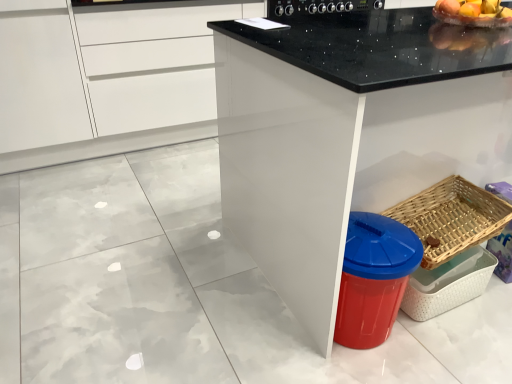
The image size is (512, 384). What do you see at coordinates (112, 82) in the screenshot?
I see `white glossy cabinet at upper left` at bounding box center [112, 82].

What do you see at coordinates (451, 218) in the screenshot? The image size is (512, 384). I see `woven wood basket at lower right` at bounding box center [451, 218].

Describe the element at coordinates (323, 11) in the screenshot. I see `black glossy stove at upper center` at that location.

This screenshot has width=512, height=384. Describe the element at coordinates (473, 8) in the screenshot. I see `shiny plastic bowl at upper right` at that location.

Locate an element on the screen. This screenshot has width=512, height=384. white glossy cabinet at upper left is located at coordinates (112, 82).

Consider the image. Considering the sizes of black glossy stove at upper center and woven wood basket at lower right in the image, is black glossy stove at upper center bigger or smaller than woven wood basket at lower right?

Clearly, black glossy stove at upper center is larger in size than woven wood basket at lower right.

From a real-world perspective, is black glossy stove at upper center physically below woven wood basket at lower right?

No, from a real-world perspective, black glossy stove at upper center is not beneath woven wood basket at lower right.

Based on their positions, is black glossy stove at upper center located to the left or right of woven wood basket at lower right?

Clearly, black glossy stove at upper center is on the left of woven wood basket at lower right in the image.

Is the surface of black glossy stove at upper center in direct contact with woven wood basket at lower right?

No, black glossy stove at upper center is not making contact with woven wood basket at lower right.

Can you tell me how much shiny plastic bowl at upper right and black granite countertop at center differ in facing direction?

They differ by 3.02 degrees in their facing directions.

Is black granite countertop at center inside shiny plastic bowl at upper right?

Actually, black granite countertop at center is outside shiny plastic bowl at upper right.

How far apart are shiny plastic bowl at upper right and black granite countertop at center?

shiny plastic bowl at upper right and black granite countertop at center are 25.53 inches apart from each other.

Can you confirm if shiny plastic bowl at upper right is positioned to the right of black granite countertop at center?

No.

Is black glossy stove at upper center completely or partially inside shiny plastic bowl at upper right?

Actually, black glossy stove at upper center is outside shiny plastic bowl at upper right.

Considering the relative positions of shiny plastic bowl at upper right and black glossy stove at upper center in the image provided, is shiny plastic bowl at upper right in front of black glossy stove at upper center?

Yes, it is.

Which is closer to the camera, (509, 17) or (334, 12)?

Point (509, 17).

How different are the orientations of black glossy stove at upper center and shiny plastic bowl at upper right in degrees?

There is a 1.65-degree angle between the facing directions of black glossy stove at upper center and shiny plastic bowl at upper right.

Where is `fruit that appears on the right of black glossy stove at upper center`? Image resolution: width=512 pixels, height=384 pixels. fruit that appears on the right of black glossy stove at upper center is located at coordinates (473, 8).

Does point (380, 7) lie in front of point (437, 3)?

That is True.

Is black glossy stove at upper center smaller than shiny plastic bowl at upper right?

No, black glossy stove at upper center is not smaller than shiny plastic bowl at upper right.

You are a GUI agent. You are given a task and a screenshot of the screen. Output one action in this format:
    pyautogui.click(x=<x>, y=<y>)
    Task: Click on the basket on the right of white glossy cabinet at upper left
    Image resolution: width=512 pixels, height=384 pixels.
    Given the screenshot: What is the action you would take?
    pyautogui.click(x=451, y=218)

From their relative heights in the image, would you say white glossy cabinet at upper left is taller or shorter than woven wood basket at lower right?

white glossy cabinet at upper left is taller than woven wood basket at lower right.

From the picture: From the image's perspective, does white glossy cabinet at upper left appear higher than woven wood basket at lower right?

Indeed, from the image's perspective, white glossy cabinet at upper left is shown above woven wood basket at lower right.

Is white glossy cabinet at upper left to the left of woven wood basket at lower right from the viewer's perspective?

Yes, white glossy cabinet at upper left is to the left of woven wood basket at lower right.

Is shiny plastic bowl at upper right spatially inside white glossy cabinet at upper left, or outside of it?

shiny plastic bowl at upper right exists outside the volume of white glossy cabinet at upper left.

Is point (510, 15) positioned after point (134, 103)?

No, it is in front of (134, 103).

Are shiny plastic bowl at upper right and white glossy cabinet at upper left far apart?

Yes.

Which is more to the left, shiny plastic bowl at upper right or white glossy cabinet at upper left?

white glossy cabinet at upper left.

From a real-world perspective, who is located higher, woven wood basket at lower right or shiny plastic bowl at upper right?

shiny plastic bowl at upper right.

How distant is woven wood basket at lower right from shiny plastic bowl at upper right?

A distance of 27.93 inches exists between woven wood basket at lower right and shiny plastic bowl at upper right.

Is point (485, 217) more distant than point (445, 3)?

That is False.

How many degrees apart are the facing directions of woven wood basket at lower right and shiny plastic bowl at upper right?

The facing directions of woven wood basket at lower right and shiny plastic bowl at upper right are 1.5 degrees apart.

Locate an element on the screen. This screenshot has height=384, width=512. appliance above the woven wood basket at lower right (from the image's perspective) is located at coordinates (323, 11).

Where is `countertop below the shiny plastic bowl at upper right (from the image's perspective)`? countertop below the shiny plastic bowl at upper right (from the image's perspective) is located at coordinates (349, 134).

Which object lies further to the anchor point black granite countertop at center, white glossy cabinet at upper left or woven wood basket at lower right?

white glossy cabinet at upper left is positioned further to the anchor black granite countertop at center.

Which object lies further to the anchor point shiny plastic bowl at upper right, black glossy stove at upper center or woven wood basket at lower right?

Based on the image, woven wood basket at lower right appears to be further to shiny plastic bowl at upper right.

Looking at the image, which one is located closer to black granite countertop at center, black glossy stove at upper center or shiny plastic bowl at upper right?

The object closer to black granite countertop at center is black glossy stove at upper center.

When comparing their distances from woven wood basket at lower right, does black glossy stove at upper center or white glossy cabinet at upper left seem closer?

The object closer to woven wood basket at lower right is black glossy stove at upper center.

Looking at this image, when comparing their distances from white glossy cabinet at upper left, does black glossy stove at upper center or woven wood basket at lower right seem further?

Among the two, woven wood basket at lower right is located further to white glossy cabinet at upper left.

Estimate the real-world distances between objects in this image. Which object is closer to black glossy stove at upper center, shiny plastic bowl at upper right or black granite countertop at center?

shiny plastic bowl at upper right.

From the image, which object appears to be nearer to black glossy stove at upper center, white glossy cabinet at upper left or shiny plastic bowl at upper right?

shiny plastic bowl at upper right lies closer to black glossy stove at upper center than the other object.

Considering their positions, is woven wood basket at lower right positioned further to white glossy cabinet at upper left than black glossy stove at upper center?

woven wood basket at lower right is further to white glossy cabinet at upper left.

The width and height of the screenshot is (512, 384). I want to click on basket between white glossy cabinet at upper left and shiny plastic bowl at upper right in the horizontal direction, so click(451, 218).

Where is `countertop between shiny plastic bowl at upper right and woven wood basket at lower right vertically`? countertop between shiny plastic bowl at upper right and woven wood basket at lower right vertically is located at coordinates (349, 134).

The height and width of the screenshot is (384, 512). Find the location of `fruit located between black granite countertop at center and black glossy stove at upper center in the depth direction`. fruit located between black granite countertop at center and black glossy stove at upper center in the depth direction is located at coordinates (473, 8).

You are a GUI agent. You are given a task and a screenshot of the screen. Output one action in this format:
    pyautogui.click(x=<x>, y=<y>)
    Task: Click on the cabinetry between black granite countertop at center and black glossy stove at upper center in the front-back direction
    The height and width of the screenshot is (384, 512).
    Given the screenshot: What is the action you would take?
    pyautogui.click(x=112, y=82)